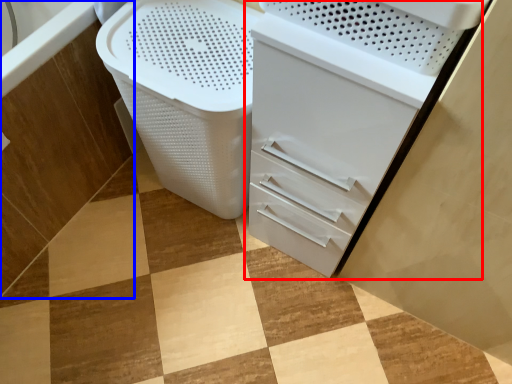
Question: Which point is further to the camera, file cabinet (highlighted by a red box) or bath (highlighted by a blue box)?

Choices:
 (A) file cabinet
 (B) bath

Answer: (B)